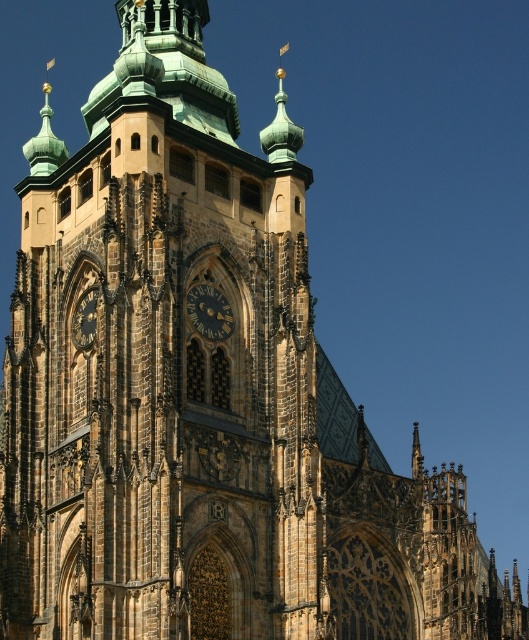
Question: Is dark brown stone clock at center bigger than gold metallic clock at center?

Choices:
 (A) yes
 (B) no

Answer: (B)

Question: Which point is farther from the camera taking this photo?

Choices:
 (A) (189, 321)
 (B) (77, 324)

Answer: (B)

Question: Is dark brown stone clock at center below gold metallic clock at center?

Choices:
 (A) yes
 (B) no

Answer: (B)

Question: Does dark brown stone clock at center have a larger size compared to gold metallic clock at center?

Choices:
 (A) no
 (B) yes

Answer: (A)